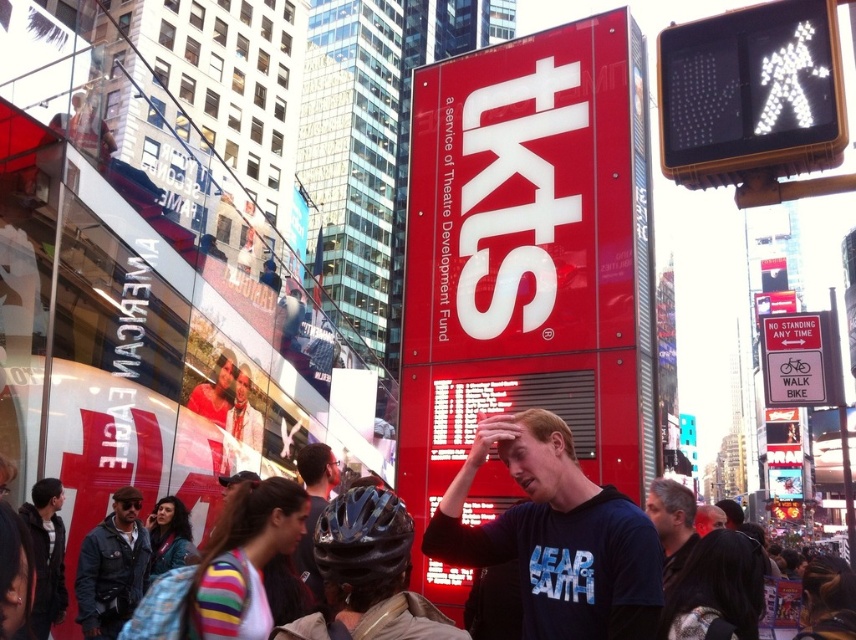
Which of these two, black matte t-shirt at center or dark blue jacket at lower left, stands shorter?

black matte t-shirt at center

Can you confirm if black matte t-shirt at center is shorter than dark blue jacket at lower left?

Yes.

Which is in front, point (649, 611) or point (114, 586)?

Point (649, 611) is in front.

Locate an element on the screen. This screenshot has height=640, width=856. black matte t-shirt at center is located at coordinates (556, 536).

Can you confirm if black matte t-shirt at center is wider than dark blue t-shirt at center?

No.

Between point (645, 531) and point (851, 550), which one is positioned in front?

Point (645, 531)

Locate an element on the screen. black matte t-shirt at center is located at coordinates (556, 536).

Where is `black matte t-shirt at center`? black matte t-shirt at center is located at coordinates (556, 536).

Can you confirm if red matte sign at center is positioned to the left of dark blue helmet at center?

No, red matte sign at center is not to the left of dark blue helmet at center.

Between red matte sign at center and dark blue helmet at center, which one is positioned higher?

red matte sign at center

Who is more distant from viewer, (x=474, y=129) or (x=318, y=452)?

Point (x=474, y=129)

This screenshot has height=640, width=856. I want to click on red matte sign at center, so click(530, 252).